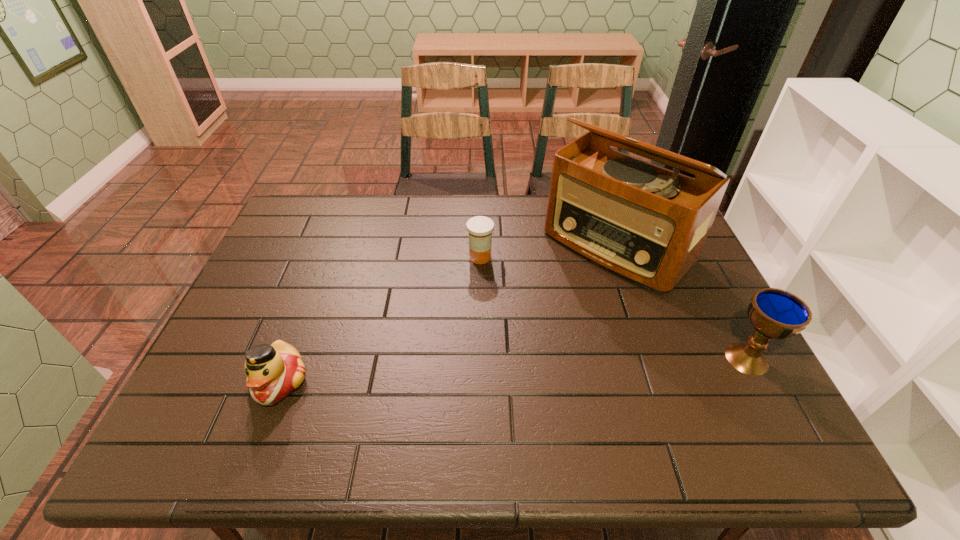
Find the location of a particular element. duck is located at coordinates (273, 372).

You are a GUI agent. You are given a task and a screenshot of the screen. Output one action in this format:
    pyautogui.click(x=<x>, y=<y>)
    Task: Click on the chalice
    The height and width of the screenshot is (540, 960).
    Given the screenshot: What is the action you would take?
    pyautogui.click(x=774, y=313)

The height and width of the screenshot is (540, 960). Identify the location of the third object from right to left. (480, 228).

The width and height of the screenshot is (960, 540). Find the location of `the tallest object`. the tallest object is located at coordinates (648, 224).

Locate an element on the screen. This screenshot has height=540, width=960. free space located 0.180m on the back of the second tallest object is located at coordinates (710, 289).

Locate an element on the screen. The height and width of the screenshot is (540, 960). vacant space located 0.240m on the label of the second object from left to right is located at coordinates (495, 326).

Where is `blank space located 0.390m on the label of the second object from left to right`? The width and height of the screenshot is (960, 540). blank space located 0.390m on the label of the second object from left to right is located at coordinates (506, 374).

The height and width of the screenshot is (540, 960). In order to click on vacant space located on the label of the second object from left to right in this screenshot , I will do `click(501, 351)`.

Identify the location of vacant space located 0.220m on the front panel of the radio receiver. The width and height of the screenshot is (960, 540). (531, 325).

Where is `vacant area located on the front panel of the radio receiver`? The width and height of the screenshot is (960, 540). vacant area located on the front panel of the radio receiver is located at coordinates (488, 364).